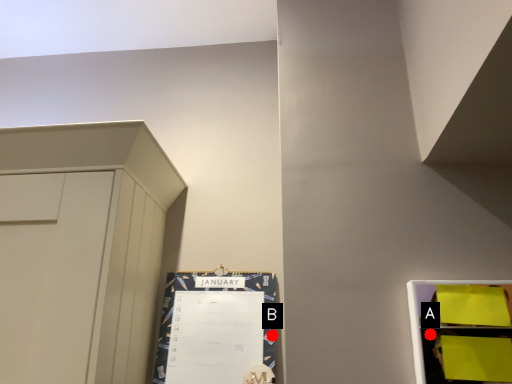
Question: Two points are circled on the image, labeled by A and B beside each circle. Which of the following is the farthest from the observer?

Choices:
 (A) A is further
 (B) B is further

Answer: (B)